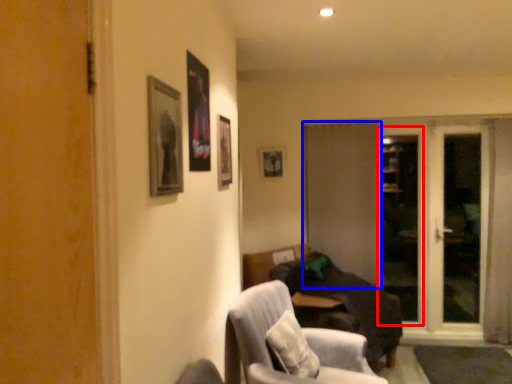
Question: Which object appears farthest to the camera in this image, screen door (highlighted by a red box) or door (highlighted by a blue box)?

Choices:
 (A) screen door
 (B) door

Answer: (A)